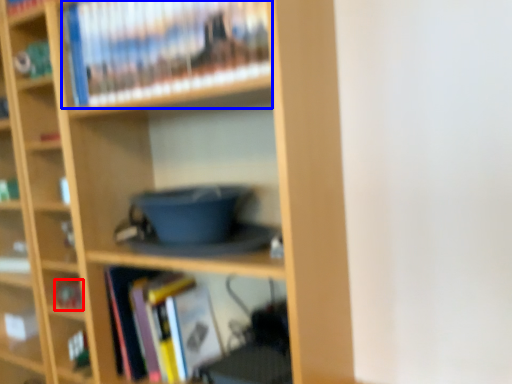
Question: Among these objects, which one is nearest to the camera, book (highlighted by a red box) or book (highlighted by a blue box)?

Choices:
 (A) book
 (B) book

Answer: (B)